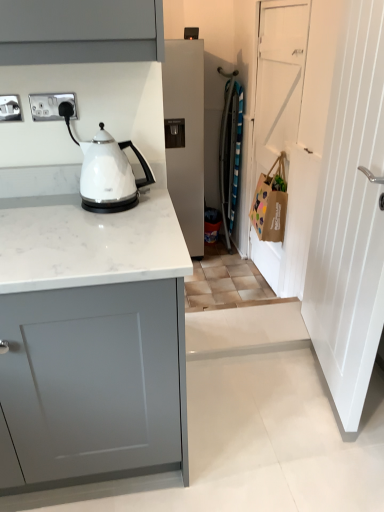
This screenshot has width=384, height=512. What do you see at coordinates (89, 317) in the screenshot?
I see `white marble countertop at center` at bounding box center [89, 317].

This screenshot has height=512, width=384. In order to click on white wooden door at right, placed as the 2th door when sorted from back to front in this screenshot , I will do `click(350, 217)`.

This screenshot has height=512, width=384. What do you see at coordinates (10, 108) in the screenshot?
I see `satin silver socket at upper left, which appears as the second electric outlet when viewed from the right` at bounding box center [10, 108].

Identify the location of chrome metallic plug socket at left, the 1th electric outlet from the right. This screenshot has width=384, height=512. (52, 106).

Describe the element at coordinates (186, 136) in the screenshot. The height and width of the screenshot is (512, 384). I see `white matte refrigerator at center` at that location.

Image resolution: width=384 pixels, height=512 pixels. Identify the location of white glossy kettle at left. (110, 174).

At what (x,y) coordinates should I click in order to perform the action: click on white matte door at right, the 2th door from the front. Please return your answer as a coordinate pair (x, y). The image size is (384, 512). Looking at the image, I should click on (279, 78).

At what (x,y) coordinates should I click in order to perform the action: click on white marble countertop at center. Please return your answer as a coordinate pair (x, y). Looking at the image, I should click on (89, 317).

Consider the image. Between white wooden door at right, placed as the 2th door when sorted from back to front, and white matte door at right, which ranks as the first door in back-to-front order, which one appears on the left side from the viewer's perspective?

Positioned to the left is white wooden door at right, placed as the 2th door when sorted from back to front.

Can you confirm if white wooden door at right, placed as the 2th door when sorted from back to front, is smaller than white matte door at right, the 2th door from the front?

→ No.

Would you consider white wooden door at right, placed as the 2th door when sorted from back to front, to be distant from white matte door at right, which ranks as the first door in back-to-front order?

Yes, white wooden door at right, placed as the 2th door when sorted from back to front, is far from white matte door at right, which ranks as the first door in back-to-front order.

From the image's perspective, would you say white wooden door at right, the first door when ordered from front to back, is positioned over white matte door at right, the 2th door from the front?

No, from the image's perspective, white wooden door at right, the first door when ordered from front to back, is not on top of white matte door at right, the 2th door from the front.

From the image's perspective, does brown paper bag at right appear higher than white matte door at right, the 2th door from the front?

No.

Is brown paper bag at right with white matte door at right, which ranks as the first door in back-to-front order?

brown paper bag at right and white matte door at right, which ranks as the first door in back-to-front order, are clearly separated.

How different are the orientations of brown paper bag at right and white matte door at right, which ranks as the first door in back-to-front order, in degrees?

There is a 0.00478-degree angle between the facing directions of brown paper bag at right and white matte door at right, which ranks as the first door in back-to-front order.

Find the location of `shopping bag that appears below the white matte door at right, which ranks as the first door in back-to-front order (from the image's perspective)`. shopping bag that appears below the white matte door at right, which ranks as the first door in back-to-front order (from the image's perspective) is located at coordinates (270, 204).

Is chrome metallic plug socket at left, the 1th electric outlet from the right, placed right next to white glossy kettle at left?

chrome metallic plug socket at left, the 1th electric outlet from the right, and white glossy kettle at left are clearly separated.

Based on the photo, is chrome metallic plug socket at left, the 1th electric outlet from the right, inside the boundaries of white glossy kettle at left, or outside?

chrome metallic plug socket at left, the 1th electric outlet from the right, is outside white glossy kettle at left.

Can you confirm if chrome metallic plug socket at left, the 1th electric outlet from the right, is positioned to the right of white glossy kettle at left?

No.

From a real-world perspective, who is located lower, white matte door at right, the 2th door from the front, or chrome metallic plug socket at left, the 1th electric outlet from the right?

white matte door at right, the 2th door from the front, is physically lower.

Is white matte door at right, the 2th door from the front, in contact with chrome metallic plug socket at left, the second electric outlet from the left?

No, white matte door at right, the 2th door from the front, is not beside chrome metallic plug socket at left, the second electric outlet from the left.

Can you confirm if white matte door at right, which ranks as the first door in back-to-front order, is thinner than chrome metallic plug socket at left, the second electric outlet from the left?

No.

Between point (259, 140) and point (49, 113), which one is positioned behind?

Positioned behind is point (259, 140).

Considering the points (123, 162) and (261, 191), which point is in front, point (123, 162) or point (261, 191)?

The point (123, 162) is closer to the camera.

This screenshot has width=384, height=512. I want to click on shopping bag below the white glossy kettle at left (from a real-world perspective), so click(x=270, y=204).

From a real-world perspective, is white glossy kettle at left over brown paper bag at right?

Correct, in the physical world, white glossy kettle at left is higher than brown paper bag at right.

Is white glossy kettle at left to the left or to the right of brown paper bag at right in the image?

In the image, white glossy kettle at left appears on the left side of brown paper bag at right.

Is chrome metallic plug socket at left, the 1th electric outlet from the right, oriented towards white matte door at right, which ranks as the first door in back-to-front order?

No, chrome metallic plug socket at left, the 1th electric outlet from the right, is not oriented towards white matte door at right, which ranks as the first door in back-to-front order.

Is white matte door at right, which ranks as the first door in back-to-front order, completely or partially inside chrome metallic plug socket at left, the 1th electric outlet from the right?

No, chrome metallic plug socket at left, the 1th electric outlet from the right, does not contain white matte door at right, which ranks as the first door in back-to-front order.

You are a GUI agent. You are given a task and a screenshot of the screen. Output one action in this format:
    pyautogui.click(x=<x>, y=<y>)
    Task: Click on the countertop that appears below the brown paper bag at right (from the image's perspective)
    Image resolution: width=384 pixels, height=512 pixels.
    Given the screenshot: What is the action you would take?
    pyautogui.click(x=89, y=317)

Could you tell me if brown paper bag at right is facing white marble countertop at center?

No, brown paper bag at right is not oriented towards white marble countertop at center.

Would you say brown paper bag at right is inside or outside white marble countertop at center?

The correct answer is: outside.

Is the surface of brown paper bag at right in direct contact with white marble countertop at center?

No, brown paper bag at right is not touching white marble countertop at center.

Image resolution: width=384 pixels, height=512 pixels. Find the location of `door on the left of white matte door at right, which ranks as the first door in back-to-front order`. door on the left of white matte door at right, which ranks as the first door in back-to-front order is located at coordinates (350, 217).

The height and width of the screenshot is (512, 384). I want to click on door that is the 1st object above the brown paper bag at right (from a real-world perspective), so click(x=279, y=78).

When comparing their distances from white matte refrigerator at center, does white glossy kettle at left or chrome metallic plug socket at left, the 1th electric outlet from the right, seem further?

The object further to white matte refrigerator at center is chrome metallic plug socket at left, the 1th electric outlet from the right.

When comparing their distances from white matte door at right, which ranks as the first door in back-to-front order, does chrome metallic plug socket at left, the 1th electric outlet from the right, or satin silver socket at upper left, which appears as the second electric outlet when viewed from the right, seem further?

Among the two, satin silver socket at upper left, which appears as the second electric outlet when viewed from the right, is located further to white matte door at right, which ranks as the first door in back-to-front order.

Based on their spatial positions, is white matte door at right, the 2th door from the front, or white marble countertop at center closer to white wooden door at right, the first door when ordered from front to back?

white marble countertop at center lies closer to white wooden door at right, the first door when ordered from front to back, than the other object.

From the image, which object appears to be nearer to white marble countertop at center, white matte refrigerator at center or satin silver socket at upper left, marked as the 1th electric outlet in a left-to-right arrangement?

The object closer to white marble countertop at center is satin silver socket at upper left, marked as the 1th electric outlet in a left-to-right arrangement.

Looking at the image, which one is located further to white marble countertop at center, satin silver socket at upper left, marked as the 1th electric outlet in a left-to-right arrangement, or white glossy kettle at left?

satin silver socket at upper left, marked as the 1th electric outlet in a left-to-right arrangement, is further to white marble countertop at center.

When comparing their distances from white marble countertop at center, does white glossy kettle at left or satin silver socket at upper left, which appears as the second electric outlet when viewed from the right, seem further?

The object further to white marble countertop at center is satin silver socket at upper left, which appears as the second electric outlet when viewed from the right.

In the scene shown: When comparing their distances from white marble countertop at center, does white matte refrigerator at center or white glossy kettle at left seem further?

Among the two, white matte refrigerator at center is located further to white marble countertop at center.

Based on their spatial positions, is white wooden door at right, the first door when ordered from front to back, or white matte refrigerator at center further from white matte door at right, which ranks as the first door in back-to-front order?

Based on the image, white wooden door at right, the first door when ordered from front to back, appears to be further to white matte door at right, which ranks as the first door in back-to-front order.

Image resolution: width=384 pixels, height=512 pixels. I want to click on door between satin silver socket at upper left, which appears as the second electric outlet when viewed from the right, and white matte refrigerator at center, along the z-axis, so click(x=279, y=78).

The width and height of the screenshot is (384, 512). I want to click on electric outlet between satin silver socket at upper left, marked as the 1th electric outlet in a left-to-right arrangement, and white matte door at right, the 2th door from the front, in the horizontal direction, so click(52, 106).

This screenshot has height=512, width=384. What are the coordinates of `kitchen appliance positioned between white marble countertop at center and white matte door at right, which ranks as the first door in back-to-front order, from near to far` in the screenshot? It's located at (110, 174).

Identify the location of shopping bag between white marble countertop at center and white matte refrigerator at center along the z-axis. [x=270, y=204].